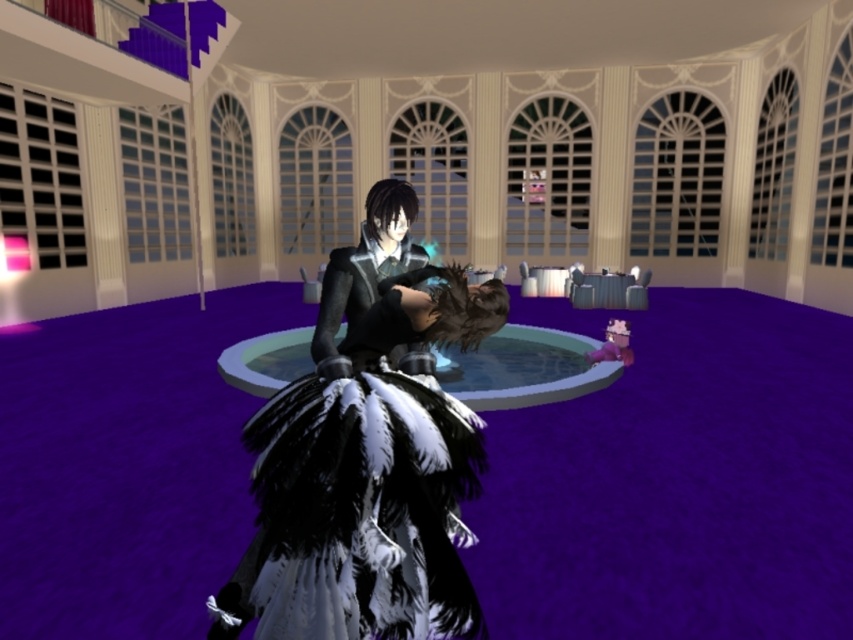
You are a game developer designing a scene where two characters are positioned at the center of a room. The feathered black dress at center and the shiny black dress at center are both present. Which character should you adjust to ensure they are the same width as the other?

The feathered black dress at center is narrower than the shiny black dress at center, so you should adjust the feathered black dress at center to match the width of the shiny black dress at center.

You are a character in the game who needs to decide which dress to wear for a formal event. Both the feathered black dress at center and the shiny black dress at center are options. Based on their sizes, which one would be more suitable for a dance performance that requires flexibility?

The shiny black dress at center is shorter and more flexible, making it better suited for dance performances that require movement.